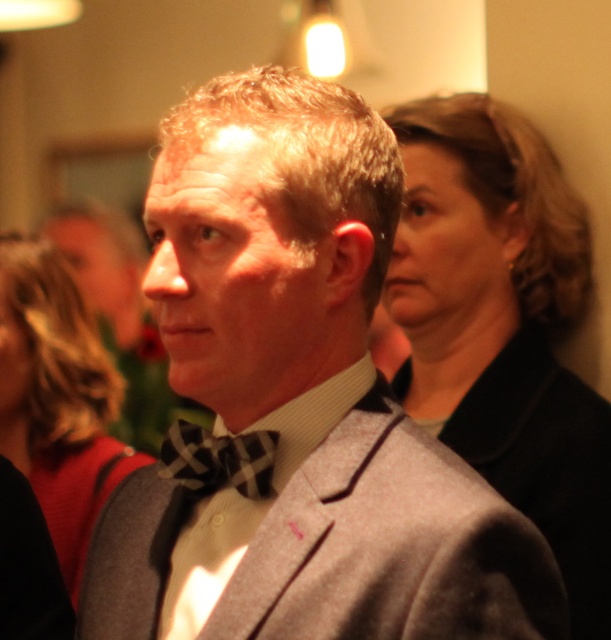
Consider the image. Who is more distant from viewer, (502,260) or (500,600)?

The point (502,260) is more distant.

Does smooth black jacket at upper right appear over gray woolen blazer at center?

Correct, smooth black jacket at upper right is located above gray woolen blazer at center.

Which is in front, point (527, 401) or point (378, 556)?

Positioned in front is point (378, 556).

What are the coordinates of `smooth black jacket at upper right` in the screenshot? It's located at (502, 324).

How far apart are gray woolen blazer at center and plaid fabric bow tie at center?

gray woolen blazer at center is 4.64 inches away from plaid fabric bow tie at center.

In the scene shown: Between gray woolen blazer at center and plaid fabric bow tie at center, which one appears on the right side from the viewer's perspective?

From the viewer's perspective, gray woolen blazer at center appears more on the right side.

Is point (345, 468) positioned in front of point (166, 451)?

Yes, point (345, 468) is closer to viewer.

Image resolution: width=611 pixels, height=640 pixels. Find the location of `gray woolen blazer at center`. gray woolen blazer at center is located at coordinates (390, 547).

Is gray wool suit at center bigger than plaid fabric bow tie at center?

Correct, gray wool suit at center is larger in size than plaid fabric bow tie at center.

Which is behind, point (381, 163) or point (230, 438)?

The point (230, 438) is behind.

Identify the location of gray wool suit at center. (298, 403).